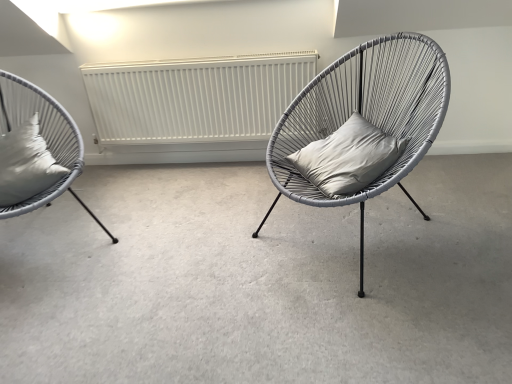
Describe the element at coordinates (26, 164) in the screenshot. I see `satin white cushion at left, the first pillow viewed from the left` at that location.

Where is `matte gray wicker chair at left, which is the 2th chair from right to left`? The image size is (512, 384). matte gray wicker chair at left, which is the 2th chair from right to left is located at coordinates (44, 138).

Looking at their sizes, would you say matte gray wicker chair at left, which is the 2th chair from right to left, is wider or thinner than gray matte pillow at center, the second pillow from the left?

Considering their sizes, matte gray wicker chair at left, which is the 2th chair from right to left, looks broader than gray matte pillow at center, the second pillow from the left.

From the picture: Can you tell me how much matte gray wicker chair at left, which is counted as the first chair, starting from the left, and gray matte pillow at center, the first pillow in the right-to-left sequence, differ in facing direction?

The angular difference between matte gray wicker chair at left, which is counted as the first chair, starting from the left, and gray matte pillow at center, the first pillow in the right-to-left sequence, is 110 degrees.

Looking at this image, is matte gray wicker chair at left, which is the 2th chair from right to left, completely or partially outside of gray matte pillow at center, the second pillow from the left?

Yes.

From the image's perspective, between satin white cushion at left, the first pillow viewed from the left, and matte gray wicker chair at center, placed as the 2th chair when sorted from left to right, who is located below?

satin white cushion at left, the first pillow viewed from the left.

Considering the sizes of objects satin white cushion at left, the first pillow viewed from the left, and matte gray wicker chair at center, placed as the 2th chair when sorted from left to right, in the image provided, who is taller, satin white cushion at left, the first pillow viewed from the left, or matte gray wicker chair at center, placed as the 2th chair when sorted from left to right,?

With more height is matte gray wicker chair at center, placed as the 2th chair when sorted from left to right.

From the picture: Is satin white cushion at left, the second pillow positioned from the right, placed right next to matte gray wicker chair at center, placed as the 2th chair when sorted from left to right?

There is a gap between satin white cushion at left, the second pillow positioned from the right, and matte gray wicker chair at center, placed as the 2th chair when sorted from left to right.

Is the depth of satin white cushion at left, the first pillow viewed from the left, less than that of matte gray wicker chair at center, the 1th chair in the right-to-left sequence?

That is False.

Where is `concrete below the satin white cushion at left, the second pillow positioned from the right (from a real-world perspective)`? This screenshot has height=384, width=512. concrete below the satin white cushion at left, the second pillow positioned from the right (from a real-world perspective) is located at coordinates (261, 281).

Considering the sizes of objects gray matte cushion at center and satin white cushion at left, the second pillow positioned from the right, in the image provided, who is thinner, gray matte cushion at center or satin white cushion at left, the second pillow positioned from the right,?

satin white cushion at left, the second pillow positioned from the right.

Who is shorter, gray matte cushion at center or satin white cushion at left, the second pillow positioned from the right?

Standing shorter between the two is gray matte cushion at center.

Are gray matte pillow at center, the second pillow from the left, and white matte radiator at center located far from each other?

Actually, gray matte pillow at center, the second pillow from the left, and white matte radiator at center are a little close together.

Between gray matte pillow at center, the first pillow in the right-to-left sequence, and white matte radiator at center, which one has smaller size?

gray matte pillow at center, the first pillow in the right-to-left sequence, is smaller.

From their relative heights in the image, would you say gray matte pillow at center, the first pillow in the right-to-left sequence, is taller or shorter than white matte radiator at center?

Considering their sizes, gray matte pillow at center, the first pillow in the right-to-left sequence, has less height than white matte radiator at center.

Considering the points (317, 144) and (159, 110), which point is behind, point (317, 144) or point (159, 110)?

The point (159, 110) is behind.

The height and width of the screenshot is (384, 512). I want to click on radiator that appears above the gray matte cushion at center (from the image's perspective), so click(x=194, y=98).

Does gray matte cushion at center have a greater width compared to white matte radiator at center?

Correct, the width of gray matte cushion at center exceeds that of white matte radiator at center.

Which object is closer to the camera taking this photo, gray matte cushion at center or white matte radiator at center?

Positioned in front is gray matte cushion at center.

Can you confirm if gray matte cushion at center is positioned to the left of white matte radiator at center?

No.

Is matte gray wicker chair at center, the 1th chair in the right-to-left sequence, positioned behind gray matte pillow at center, the first pillow in the right-to-left sequence?

No, it is in front of gray matte pillow at center, the first pillow in the right-to-left sequence.

Which point is more forward, (436, 104) or (384, 159)?

The point (436, 104) is in front.

Is matte gray wicker chair at center, the 1th chair in the right-to-left sequence, next to gray matte pillow at center, the first pillow in the right-to-left sequence, and touching it?

There is a gap between matte gray wicker chair at center, the 1th chair in the right-to-left sequence, and gray matte pillow at center, the first pillow in the right-to-left sequence.

Is gray matte pillow at center, the first pillow in the right-to-left sequence, inside matte gray wicker chair at center, the 1th chair in the right-to-left sequence?

→ Yes, gray matte pillow at center, the first pillow in the right-to-left sequence, is surrounded by matte gray wicker chair at center, the 1th chair in the right-to-left sequence.

Between white matte radiator at center and gray matte cushion at center, which one appears on the right side from the viewer's perspective?

From the viewer's perspective, gray matte cushion at center appears more on the right side.

Relative to gray matte cushion at center, is white matte radiator at center in front or behind?

white matte radiator at center is positioned farther from the viewer than gray matte cushion at center.

Choose the correct answer: Is white matte radiator at center inside gray matte cushion at center or outside it?

white matte radiator at center is not enclosed by gray matte cushion at center.

You are a GUI agent. You are given a task and a screenshot of the screen. Output one action in this format:
    pyautogui.click(x=<x>, y=<y>)
    Task: Click on the chair below the gray matte pillow at center, the first pillow in the right-to-left sequence (from the image's perspective)
    Image resolution: width=512 pixels, height=384 pixels.
    Given the screenshot: What is the action you would take?
    pyautogui.click(x=44, y=138)

The width and height of the screenshot is (512, 384). In order to click on chair located on the right of satin white cushion at left, the second pillow positioned from the right in this screenshot , I will do `click(365, 115)`.

Which object lies nearer to the anchor point white matte radiator at center, gray matte cushion at center or matte gray wicker chair at left, which is the 2th chair from right to left?

matte gray wicker chair at left, which is the 2th chair from right to left.

Based on their spatial positions, is satin white cushion at left, the first pillow viewed from the left, or matte gray wicker chair at center, the 1th chair in the right-to-left sequence, further from gray matte pillow at center, the second pillow from the left?

satin white cushion at left, the first pillow viewed from the left, is positioned further to the anchor gray matte pillow at center, the second pillow from the left.

In the scene shown: When comparing their distances from satin white cushion at left, the second pillow positioned from the right, does gray matte pillow at center, the second pillow from the left, or matte gray wicker chair at left, which is the 2th chair from right to left, seem closer?

matte gray wicker chair at left, which is the 2th chair from right to left, lies closer to satin white cushion at left, the second pillow positioned from the right, than the other object.

From the image, which object appears to be nearer to white matte radiator at center, matte gray wicker chair at center, placed as the 2th chair when sorted from left to right, or gray matte cushion at center?

matte gray wicker chair at center, placed as the 2th chair when sorted from left to right, is positioned closer to the anchor white matte radiator at center.

From the image, which object appears to be farther from gray matte pillow at center, the second pillow from the left, matte gray wicker chair at center, placed as the 2th chair when sorted from left to right, or gray matte cushion at center?

Based on the image, gray matte cushion at center appears to be further to gray matte pillow at center, the second pillow from the left.

Considering their positions, is white matte radiator at center positioned further to gray matte cushion at center than satin white cushion at left, the second pillow positioned from the right?

white matte radiator at center lies further to gray matte cushion at center than the other object.

Which object lies further to the anchor point satin white cushion at left, the first pillow viewed from the left, matte gray wicker chair at left, which is the 2th chair from right to left, or matte gray wicker chair at center, the 1th chair in the right-to-left sequence?

matte gray wicker chair at center, the 1th chair in the right-to-left sequence, is further to satin white cushion at left, the first pillow viewed from the left.

Which object lies nearer to the anchor point gray matte cushion at center, matte gray wicker chair at center, the 1th chair in the right-to-left sequence, or gray matte pillow at center, the second pillow from the left?

matte gray wicker chair at center, the 1th chair in the right-to-left sequence.

This screenshot has height=384, width=512. I want to click on concrete between matte gray wicker chair at left, which is counted as the first chair, starting from the left, and gray matte pillow at center, the second pillow from the left, so click(261, 281).

Where is `concrete located between satin white cushion at left, the first pillow viewed from the left, and matte gray wicker chair at center, placed as the 2th chair when sorted from left to right, in the left-right direction`? concrete located between satin white cushion at left, the first pillow viewed from the left, and matte gray wicker chair at center, placed as the 2th chair when sorted from left to right, in the left-right direction is located at coordinates (261, 281).

You are a GUI agent. You are given a task and a screenshot of the screen. Output one action in this format:
    pyautogui.click(x=<x>, y=<y>)
    Task: Click on the concrete between matte gray wicker chair at left, which is the 2th chair from right to left, and matte gray wicker chair at center, the 1th chair in the right-to-left sequence
    The image size is (512, 384).
    Given the screenshot: What is the action you would take?
    pyautogui.click(x=261, y=281)

Locate an element on the screen. The width and height of the screenshot is (512, 384). radiator situated between matte gray wicker chair at left, which is counted as the first chair, starting from the left, and matte gray wicker chair at center, the 1th chair in the right-to-left sequence, from left to right is located at coordinates (194, 98).